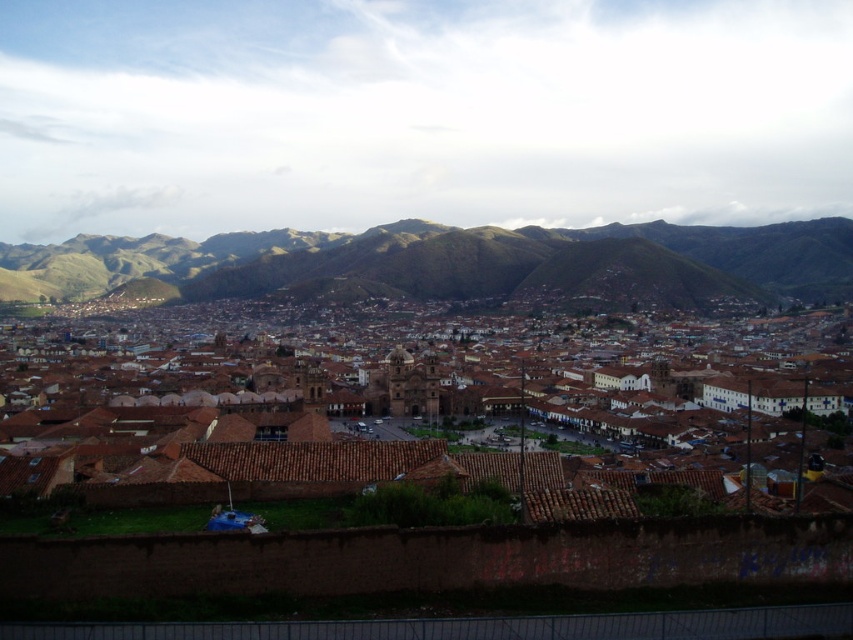
Question: Can you confirm if brown tile roofs at center is smaller than green grassy hill at center?

Choices:
 (A) no
 (B) yes

Answer: (B)

Question: Is brown tile roofs at center below green grassy hill at center?

Choices:
 (A) no
 (B) yes

Answer: (B)

Question: Considering the relative positions of brown tile roofs at center and green grassy hill at center in the image provided, where is brown tile roofs at center located with respect to green grassy hill at center?

Choices:
 (A) left
 (B) right

Answer: (B)

Question: Which object appears closest to the camera in this image?

Choices:
 (A) brown tile roofs at center
 (B) green grassy hill at center

Answer: (A)